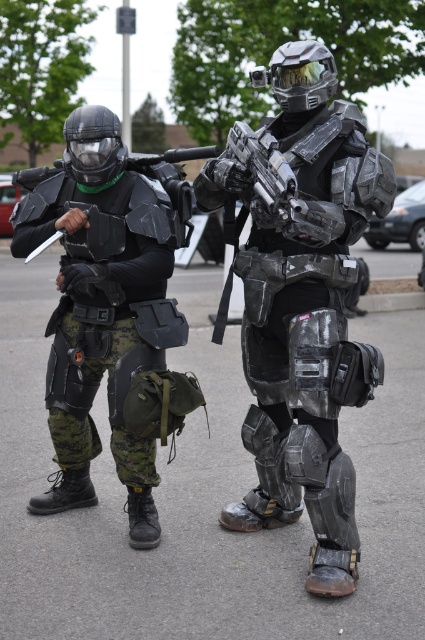
Question: Which object is closer to the camera taking this photo?

Choices:
 (A) matte black armor at left
 (B) shiny metallic armor at center

Answer: (B)

Question: Estimate the real-world distances between objects in this image. Which object is closer to the matte black armor at left?

Choices:
 (A) shiny metallic armor at center
 (B) shiny metallic gun at center

Answer: (A)

Question: Which point appears farthest from the camera in this image?

Choices:
 (A) (299, 180)
 (B) (255, 164)

Answer: (A)

Question: From the image, what is the correct spatial relationship of matte black armor at left in relation to shiny metallic gun at center?

Choices:
 (A) left
 (B) right

Answer: (A)

Question: Can you confirm if shiny metallic armor at center is positioned below matte black armor at left?

Choices:
 (A) yes
 (B) no

Answer: (B)

Question: Observing the image, what is the correct spatial positioning of matte black armor at left in reference to shiny metallic gun at center?

Choices:
 (A) below
 (B) above

Answer: (A)